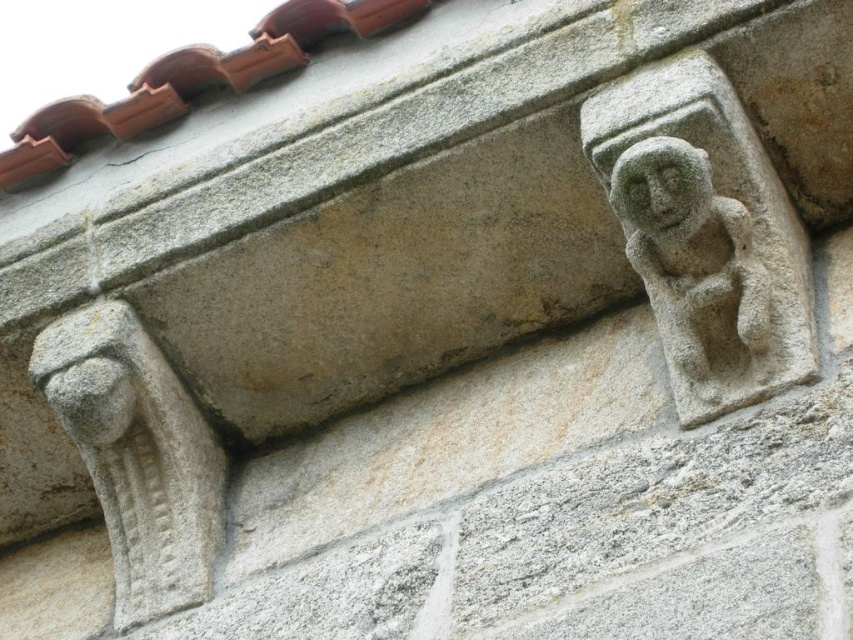
Can you confirm if gray stone monkey at upper right is taller than green mossy stone face at upper right?

Yes, gray stone monkey at upper right is taller than green mossy stone face at upper right.

Who is positioned more to the right, gray stone monkey at upper right or green mossy stone face at upper right?

Positioned to the right is gray stone monkey at upper right.

Does point (701, 403) lie behind point (668, 193)?

Yes, it is.

You are a GUI agent. You are given a task and a screenshot of the screen. Output one action in this format:
    pyautogui.click(x=<x>, y=<y>)
    Task: Click on the gray stone monkey at upper right
    The image size is (853, 640).
    Given the screenshot: What is the action you would take?
    pyautogui.click(x=697, y=273)